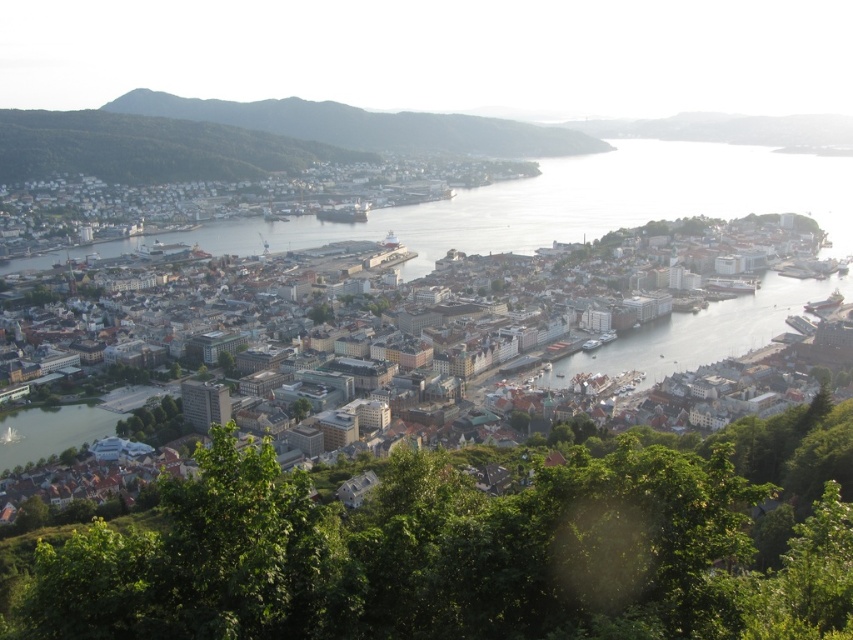
You are standing at the viewpoint overlooking the city and notice the green leafy tree at lower center and the green forested hillside at upper left. Which of these two objects is closer to your eye level?

The green leafy tree at lower center is closer to your eye level because it is shorter than the green forested hillside at upper left, which would be further away and thus appear smaller in the distance.

You are standing at the viewpoint overlooking the coastal city. There is a green leafy tree at lower center. Can you see the point at coordinates (466, 552) from your current position?

The green leafy tree at lower center is represented by point at coordinates (466, 552), so yes, you can see the point at coordinates (466, 552) from your current position because it corresponds to the location of the green leafy tree at lower center.

You are standing at the viewpoint overlooking the coastal city. You notice a green leafy tree at lower center and white matte buildings at center. Which object is closer to you based on their positions in the scene?

The green leafy tree at lower center is closer to you because it is positioned in front of the white matte buildings at center.